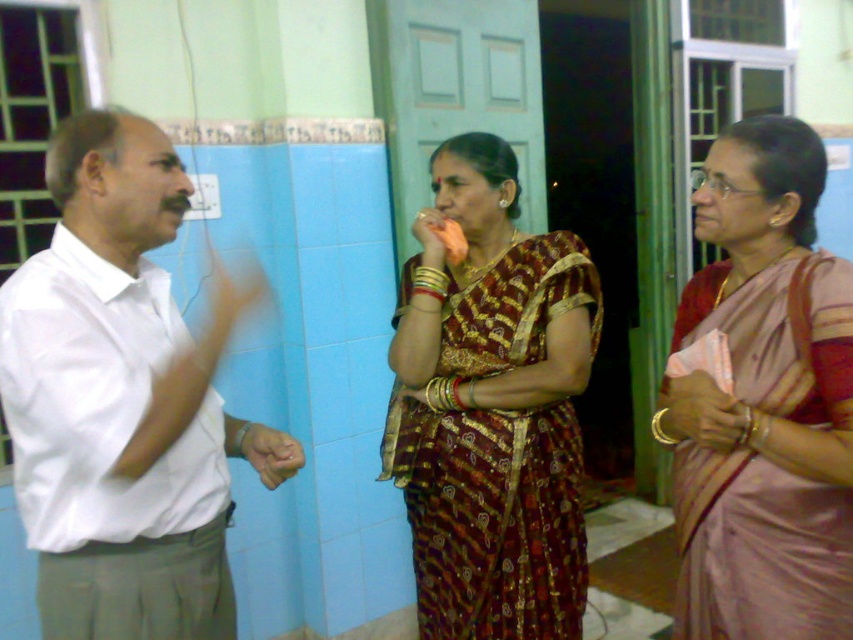
You are a photographer standing in the room. You want to take a photo that includes both the white cotton shirt at left and the maroon silk saree at center. Can you frame them in a single shot without moving either object? Explain your reasoning.

The distance between the white cotton shirt at left and the maroon silk saree at center is 22.92 inches. Since this distance is manageable within a typical camera frame, you can likely capture both in a single shot without moving either object.

You are standing in the room and want to hand a document to both the white cotton shirt at left and the pink silk saree at center. Which person should you approach first if you want to start with the one closer to the entrance?

The white cotton shirt at left is to the left of the pink silk saree at center, so if the entrance is on the left side of the room, you should approach the white cotton shirt at left first. However, without knowing the exact entrance location, we can only confirm their relative positions.

You are standing in the room and want to move from point A to point B. Point A is at coordinates point [686,458] and point B is at coordinates point [482,458]. Which direction should you move to go from point A to point B?

To move from point A at coordinates point [686,458] to point B at coordinates point [482,458], you should move downward since point A is in front of point B.